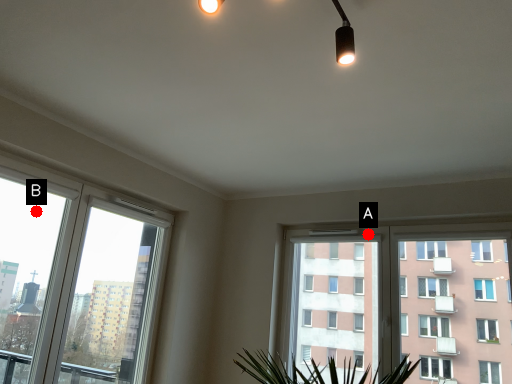
Question: Two points are circled on the image, labeled by A and B beside each circle. Among these points, which one is nearest to the camera?

Choices:
 (A) A is closer
 (B) B is closer

Answer: (B)